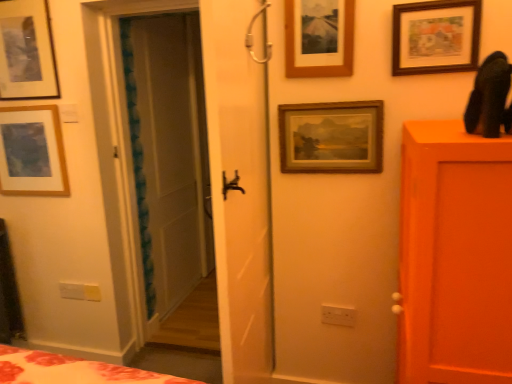
Identify the location of wooden picture frame at upper right, which is counted as the 5th picture frame, starting from the left. The height and width of the screenshot is (384, 512). (436, 37).

This screenshot has height=384, width=512. What do you see at coordinates (338, 315) in the screenshot? I see `white plastic electric outlet at lower center` at bounding box center [338, 315].

The width and height of the screenshot is (512, 384). In order to click on wooden picture frame at upper center, which is counted as the third picture frame, starting from the right in this screenshot , I will do `click(319, 40)`.

Is wooden picture frame at upper right, which is counted as the 5th picture frame, starting from the left, oriented towards wooden framed painting at center, marked as the fourth picture frame in a left-to-right arrangement?

No, wooden picture frame at upper right, which is counted as the 5th picture frame, starting from the left, does not turn towards wooden framed painting at center, marked as the fourth picture frame in a left-to-right arrangement.

From a real-world perspective, which is physically above, wooden picture frame at upper right, which is counted as the 5th picture frame, starting from the left, or wooden framed painting at center, marked as the fourth picture frame in a left-to-right arrangement?

In real-world perspective, wooden picture frame at upper right, which is counted as the 5th picture frame, starting from the left, is above.

From the picture: Is wooden framed painting at center, marked as the fourth picture frame in a left-to-right arrangement, surrounded by wooden picture frame at upper right, which is counted as the 1th picture frame, starting from the right?

No, wooden framed painting at center, marked as the fourth picture frame in a left-to-right arrangement, is located outside of wooden picture frame at upper right, which is counted as the 1th picture frame, starting from the right.

Is wooden picture frame at upper right, which is counted as the 1th picture frame, starting from the right, with wooden framed painting at center, marked as the fourth picture frame in a left-to-right arrangement?

No, wooden picture frame at upper right, which is counted as the 1th picture frame, starting from the right, is not making contact with wooden framed painting at center, marked as the fourth picture frame in a left-to-right arrangement.

Who is shorter, wooden picture frame at upper right, which is counted as the 5th picture frame, starting from the left, or matte black picture frame at upper left, which appears as the 2th picture frame when viewed from the left?

wooden picture frame at upper right, which is counted as the 5th picture frame, starting from the left, is shorter.

Is wooden picture frame at upper right, which is counted as the 5th picture frame, starting from the left, facing towards matte black picture frame at upper left, which appears as the 2th picture frame when viewed from the left?

No, wooden picture frame at upper right, which is counted as the 5th picture frame, starting from the left, does not turn towards matte black picture frame at upper left, which appears as the 2th picture frame when viewed from the left.

Relative to matte black picture frame at upper left, which appears as the 2th picture frame when viewed from the left, is wooden picture frame at upper right, which is counted as the 1th picture frame, starting from the right, in front or behind?

Visually, wooden picture frame at upper right, which is counted as the 1th picture frame, starting from the right, is located in front of matte black picture frame at upper left, which appears as the 2th picture frame when viewed from the left.

From a real-world perspective, is wooden picture frame at upper right, which is counted as the 5th picture frame, starting from the left, above or below matte black picture frame at upper left, the fourth picture frame from the right?

In terms of real-world spatial position, wooden picture frame at upper right, which is counted as the 5th picture frame, starting from the left, is below matte black picture frame at upper left, the fourth picture frame from the right.

In terms of width, does wooden framed painting at center, which is counted as the second picture frame, starting from the right, look wider or thinner when compared to matte wooden picture frame at upper left, which ranks as the 5th picture frame in right-to-left order?

wooden framed painting at center, which is counted as the second picture frame, starting from the right, is thinner than matte wooden picture frame at upper left, which ranks as the 5th picture frame in right-to-left order.

Which picture frame is the 3rd one when counting from the left side of the wooden framed painting at center, marked as the fourth picture frame in a left-to-right arrangement? Please provide its 2D coordinates.

[(32, 152)]

Based on the photo, which of these two, wooden framed painting at center, marked as the fourth picture frame in a left-to-right arrangement, or matte wooden picture frame at upper left, which ranks as the 5th picture frame in right-to-left order, stands taller?

matte wooden picture frame at upper left, which ranks as the 5th picture frame in right-to-left order.

Which is less distant, [27,172] or [306,57]?

The point [306,57] is more forward.

Would you say matte wooden picture frame at upper left, the 1th picture frame from the left, is a long distance from wooden picture frame at upper center, which is the third picture frame in left-to-right order?

Yes.

In order to click on picture frame that is the 3rd one when counting upward from the matte wooden picture frame at upper left, which ranks as the 5th picture frame in right-to-left order (from the image's perspective) in this screenshot , I will do `click(319, 40)`.

How different are the orientations of matte wooden picture frame at upper left, the 1th picture frame from the left, and wooden picture frame at upper center, which is the third picture frame in left-to-right order, in degrees?

They differ by 0.528 degrees in their facing directions.

Between point (66, 285) and point (287, 63), which one is positioned in front?

The point (287, 63) is closer to the camera.

Consider the image. Is white plastic light switch at lower left not within wooden picture frame at upper center, which is counted as the third picture frame, starting from the right?

Yes, white plastic light switch at lower left is not within wooden picture frame at upper center, which is counted as the third picture frame, starting from the right.

Would you consider white plastic light switch at lower left to be distant from wooden picture frame at upper center, which is counted as the third picture frame, starting from the right?

Yes, white plastic light switch at lower left is far from wooden picture frame at upper center, which is counted as the third picture frame, starting from the right.

From a real-world perspective, who is located lower, white plastic light switch at lower left or wooden picture frame at upper center, which is the third picture frame in left-to-right order?

white plastic light switch at lower left is physically lower.

Is wooden picture frame at upper center, which is the third picture frame in left-to-right order, beside white plastic electric outlet at lower center?

No, wooden picture frame at upper center, which is the third picture frame in left-to-right order, is not touching white plastic electric outlet at lower center.

Looking at their sizes, would you say wooden picture frame at upper center, which is the third picture frame in left-to-right order, is wider or thinner than white plastic electric outlet at lower center?

In the image, wooden picture frame at upper center, which is the third picture frame in left-to-right order, appears to be wider than white plastic electric outlet at lower center.

Consider the image. Which object is positioned more to the left, wooden picture frame at upper center, which is counted as the third picture frame, starting from the right, or white plastic electric outlet at lower center?

wooden picture frame at upper center, which is counted as the third picture frame, starting from the right.

Is white plastic light switch at lower left touching wooden picture frame at upper right, which is counted as the 1th picture frame, starting from the right?

white plastic light switch at lower left and wooden picture frame at upper right, which is counted as the 1th picture frame, starting from the right, are clearly separated.

What's the angular difference between white plastic light switch at lower left and wooden picture frame at upper right, which is counted as the 1th picture frame, starting from the right,'s facing directions?

They differ by 0.171 degrees in their facing directions.

From a real-world perspective, between white plastic light switch at lower left and wooden picture frame at upper right, which is counted as the 5th picture frame, starting from the left, who is vertically higher?

wooden picture frame at upper right, which is counted as the 5th picture frame, starting from the left, from a real-world perspective.

Between white plastic light switch at lower left and wooden picture frame at upper right, which is counted as the 1th picture frame, starting from the right, which one is positioned in front?

wooden picture frame at upper right, which is counted as the 1th picture frame, starting from the right, is more forward.

This screenshot has width=512, height=384. I want to click on the 1st picture frame below the wooden picture frame at upper right, which is counted as the 1th picture frame, starting from the right (from the image's perspective), so click(x=331, y=137).

From the wooden picture frame at upper right, which is counted as the 1th picture frame, starting from the right, count 3rd picture frames backward and point to it. Please provide its 2D coordinates.

[(26, 51)]

Considering their positions, is white plastic light switch at lower left positioned closer to white plastic electric outlet at lower center than wooden picture frame at upper right, which is counted as the 5th picture frame, starting from the left?

wooden picture frame at upper right, which is counted as the 5th picture frame, starting from the left, is positioned closer to the anchor white plastic electric outlet at lower center.

From the image, which object appears to be farther from wooden picture frame at upper center, which is counted as the third picture frame, starting from the right, wooden picture frame at upper right, which is counted as the 1th picture frame, starting from the right, or white plastic light switch at lower left?

white plastic light switch at lower left lies further to wooden picture frame at upper center, which is counted as the third picture frame, starting from the right, than the other object.

Considering their positions, is white plastic light switch at lower left positioned further to wooden picture frame at upper right, which is counted as the 1th picture frame, starting from the right, than matte wooden picture frame at upper left, the 1th picture frame from the left?

Based on the image, white plastic light switch at lower left appears to be further to wooden picture frame at upper right, which is counted as the 1th picture frame, starting from the right.

Looking at the image, which one is located further to wooden picture frame at upper right, which is counted as the 1th picture frame, starting from the right, matte wooden picture frame at upper left, the 1th picture frame from the left, or matte black picture frame at upper left, which appears as the 2th picture frame when viewed from the left?

Among the two, matte wooden picture frame at upper left, the 1th picture frame from the left, is located further to wooden picture frame at upper right, which is counted as the 1th picture frame, starting from the right.

Based on their spatial positions, is white plastic light switch at lower left or white plastic electric outlet at lower center further from matte wooden picture frame at upper left, which ranks as the 5th picture frame in right-to-left order?

white plastic electric outlet at lower center.

Estimate the real-world distances between objects in this image. Which object is further from wooden picture frame at upper center, which is the third picture frame in left-to-right order, matte black picture frame at upper left, the fourth picture frame from the right, or white plastic electric outlet at lower center?

matte black picture frame at upper left, the fourth picture frame from the right, is positioned further to the anchor wooden picture frame at upper center, which is the third picture frame in left-to-right order.

Looking at the image, which one is located further to matte black picture frame at upper left, which appears as the 2th picture frame when viewed from the left, wooden picture frame at upper center, which is counted as the third picture frame, starting from the right, or matte wooden picture frame at upper left, which ranks as the 5th picture frame in right-to-left order?

wooden picture frame at upper center, which is counted as the third picture frame, starting from the right, lies further to matte black picture frame at upper left, which appears as the 2th picture frame when viewed from the left, than the other object.

From the image, which object appears to be nearer to white plastic light switch at lower left, matte black picture frame at upper left, which appears as the 2th picture frame when viewed from the left, or matte wooden picture frame at upper left, the 1th picture frame from the left?

matte wooden picture frame at upper left, the 1th picture frame from the left.

The width and height of the screenshot is (512, 384). In order to click on picture frame situated between matte wooden picture frame at upper left, which ranks as the 5th picture frame in right-to-left order, and wooden picture frame at upper center, which is the third picture frame in left-to-right order, from left to right in this screenshot , I will do `click(26, 51)`.

Locate an element on the screen. light switch between matte black picture frame at upper left, the fourth picture frame from the right, and wooden framed painting at center, marked as the fourth picture frame in a left-to-right arrangement is located at coordinates (80, 291).

Where is `picture frame between white plastic light switch at lower left and wooden framed painting at center, marked as the fourth picture frame in a left-to-right arrangement, from left to right`? This screenshot has width=512, height=384. picture frame between white plastic light switch at lower left and wooden framed painting at center, marked as the fourth picture frame in a left-to-right arrangement, from left to right is located at coordinates (319, 40).

The width and height of the screenshot is (512, 384). In order to click on light switch located between matte wooden picture frame at upper left, the 1th picture frame from the left, and white plastic electric outlet at lower center in the left-right direction in this screenshot , I will do `click(80, 291)`.